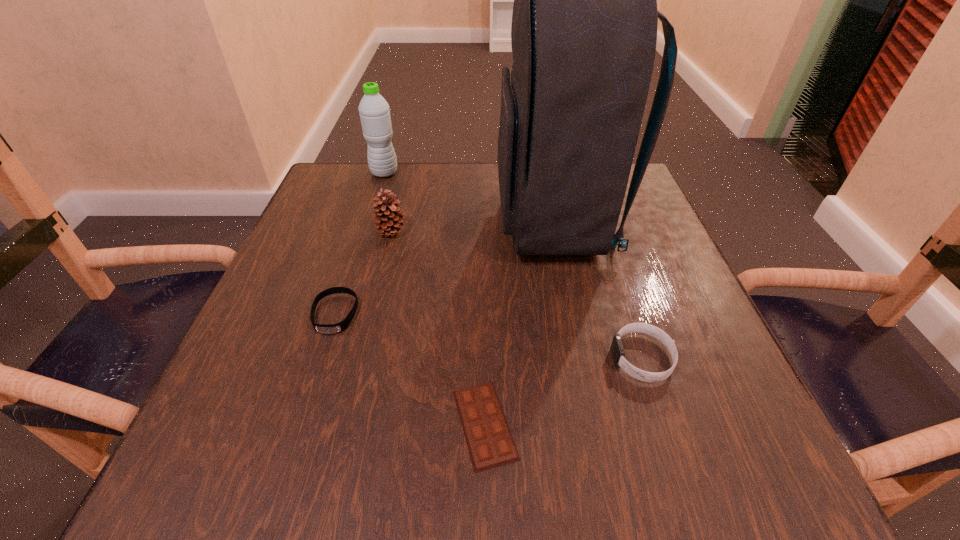
Locate an element on the screen. The height and width of the screenshot is (540, 960). vacant space located on the front-facing side of the backpack is located at coordinates (326, 222).

The width and height of the screenshot is (960, 540). Identify the location of vacant space situated on the front-facing side of the backpack. (399, 222).

The image size is (960, 540). I want to click on vacant space located 0.270m on the right of the fifth shortest object, so click(x=505, y=173).

Identify the location of free point located on the right of the pinecone. The image size is (960, 540). (468, 231).

You are a GUI agent. You are given a task and a screenshot of the screen. Output one action in this format:
    pyautogui.click(x=<x>, y=<y>)
    Task: Click on the free space located on the outer surface of the right wristband
    
    Given the screenshot: What is the action you would take?
    pyautogui.click(x=461, y=358)

Identify the location of vacant area situated on the outer surface of the right wristband. This screenshot has height=540, width=960. (436, 358).

Locate an element on the screen. This screenshot has height=540, width=960. vacant space located 0.270m on the outer surface of the right wristband is located at coordinates 442,358.

Where is `free space located on the display of the shorter wristband`? The height and width of the screenshot is (540, 960). free space located on the display of the shorter wristband is located at coordinates (283, 476).

This screenshot has height=540, width=960. Find the location of `free space located on the left of the shortest object`. free space located on the left of the shortest object is located at coordinates (365, 424).

Identify the location of backpack that is at the far edge. (584, 26).